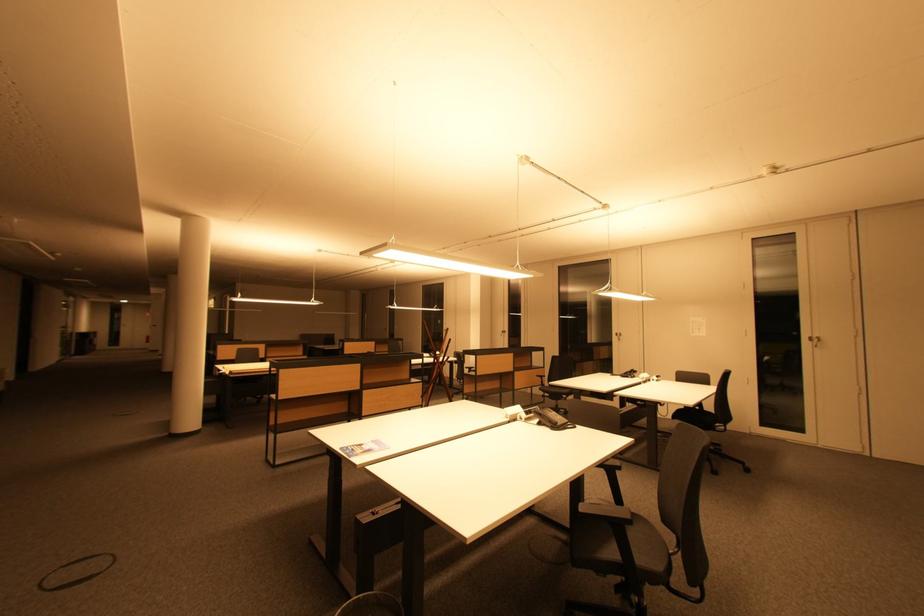
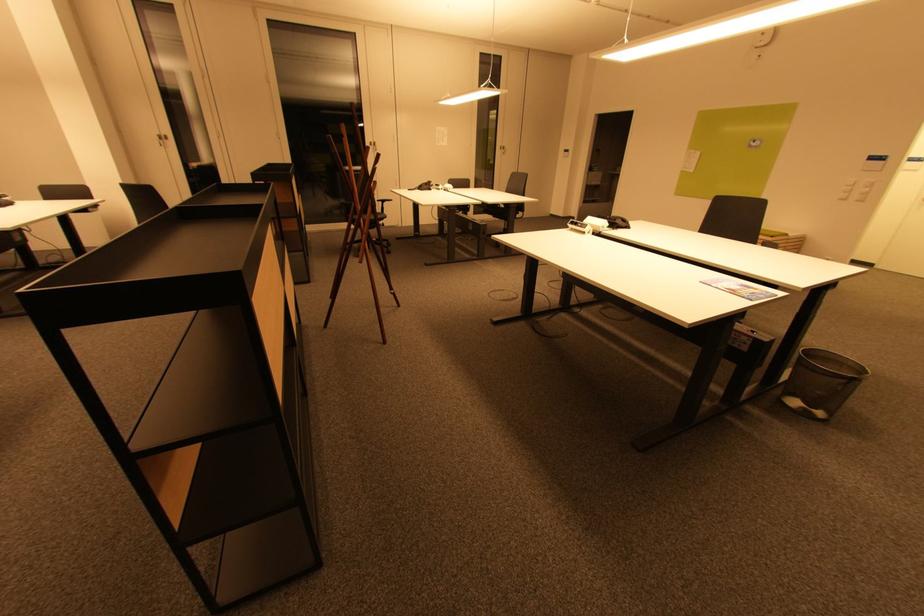
Locate, in the second image, the point that corresponds to point 507,334 in the first image.

(166, 140)